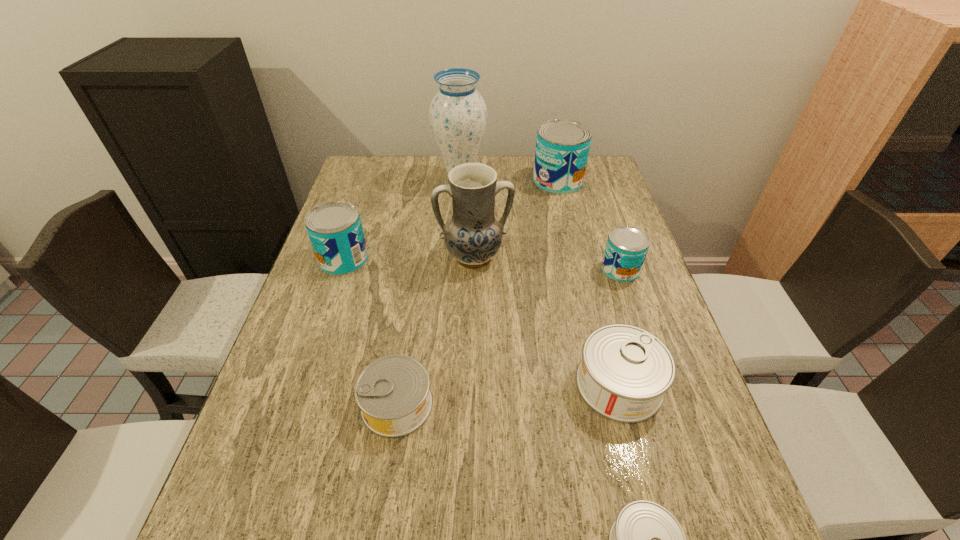
Where is `can that is at the far edge`? can that is at the far edge is located at coordinates (562, 147).

Locate an element on the screen. The height and width of the screenshot is (540, 960). object located at the left edge is located at coordinates (334, 228).

Find the location of a particular element. The width and height of the screenshot is (960, 540). object at the far right corner is located at coordinates (562, 147).

You are a GUI agent. You are given a task and a screenshot of the screen. Output one action in this format:
    pyautogui.click(x=<x>, y=<y>)
    Task: Click on the free region at the far edge
    This screenshot has width=960, height=540.
    Given the screenshot: What is the action you would take?
    pyautogui.click(x=502, y=167)

Where is `vacant area at the left edge of the desktop`? The height and width of the screenshot is (540, 960). vacant area at the left edge of the desktop is located at coordinates (387, 199).

The width and height of the screenshot is (960, 540). In order to click on free space at the right edge in this screenshot , I will do `click(708, 446)`.

Locate an element on the screen. vacant space at the far left corner is located at coordinates pos(373,191).

Identify the location of free region at the far right corner. (605, 164).

In order to click on vacant area that lies between the farthest can and the leftmost silver can in this screenshot , I will do `click(477, 293)`.

Where is `vacant point located between the blue pottery and the sixth shortest object`? The width and height of the screenshot is (960, 540). vacant point located between the blue pottery and the sixth shortest object is located at coordinates (516, 219).